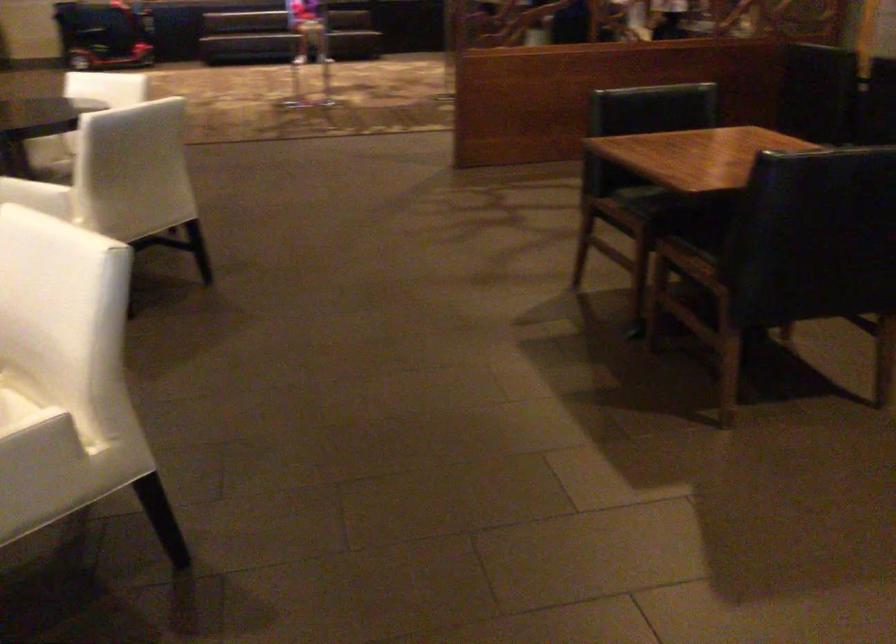
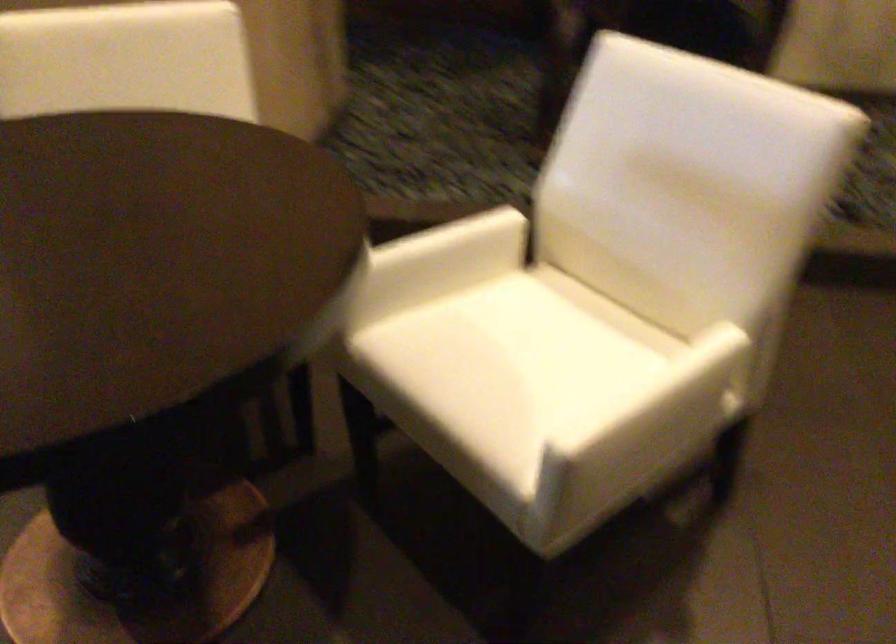
Based on the continuous images, in which direction is the camera rotating?

The camera's rotation is toward left-down.